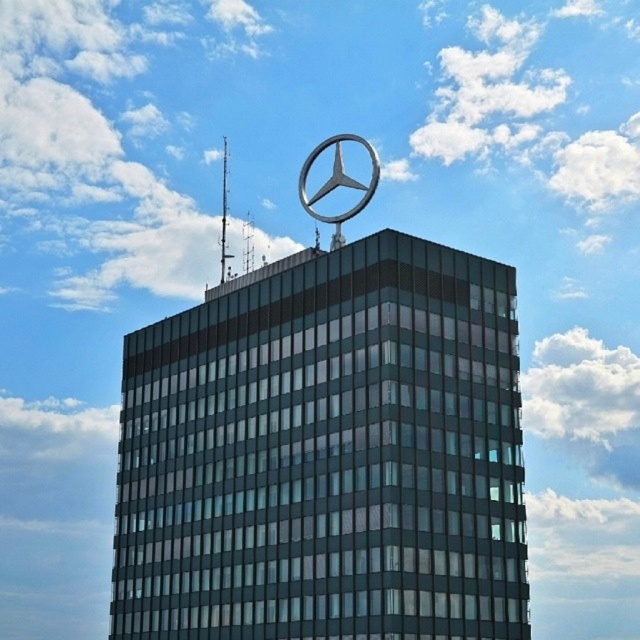
Which of these two, metallic silver mercedes-benz emblem at upper center or metallic silver star at top, stands taller?

metallic silver mercedes-benz emblem at upper center is taller.

Based on the photo, can you confirm if metallic silver mercedes-benz emblem at upper center is positioned below metallic silver star at top?

Yes, metallic silver mercedes-benz emblem at upper center is below metallic silver star at top.

Who is more distant from viewer, (300, 634) or (353, 212)?

Positioned behind is point (353, 212).

At what (x,y) coordinates should I click in order to perform the action: click on metallic silver mercedes-benz emblem at upper center. Please return your answer as a coordinate pair (x, y). Looking at the image, I should click on (326, 452).